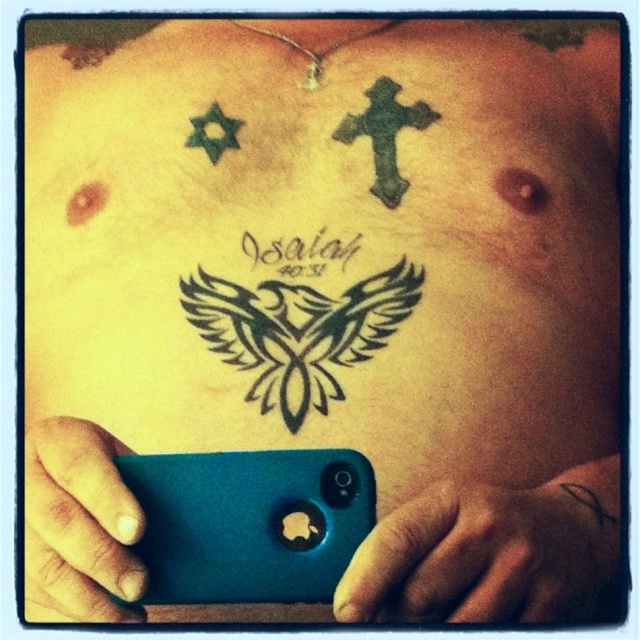
Between black ink cross at upper center and green ink star at upper left, which one appears on the left side from the viewer's perspective?

From the viewer's perspective, green ink star at upper left appears more on the left side.

Based on the photo, measure the distance between black ink cross at upper center and camera.

They are 22.81 inches apart.

What do you see at coordinates (593, 499) in the screenshot?
I see `black ink cross at upper center` at bounding box center [593, 499].

Image resolution: width=640 pixels, height=640 pixels. Find the location of `black ink cross at upper center`. black ink cross at upper center is located at coordinates (593, 499).

Does metallic apple logo at lower center have a greater width compared to black ink cross at upper center?

Incorrect, metallic apple logo at lower center's width does not surpass black ink cross at upper center's.

Is point (301, 529) more distant than point (589, 493)?

No.

Locate an element on the screen. The height and width of the screenshot is (640, 640). metallic apple logo at lower center is located at coordinates click(x=298, y=525).

Measure the distance between point (266, 250) and camera.

Point (266, 250) is 31.35 inches from camera.

Is black ink tattoo at center closer to camera compared to green ink star at upper left?

Yes.

Locate an element on the screen. This screenshot has width=640, height=640. black ink tattoo at center is located at coordinates (300, 252).